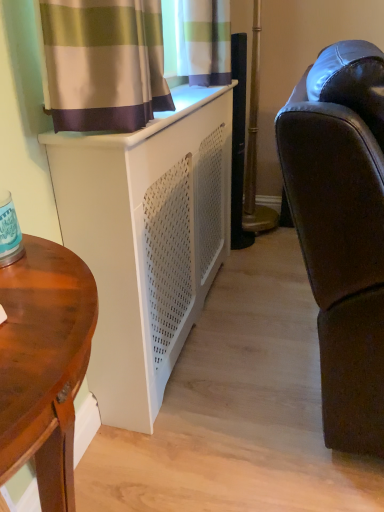
What is the approximate height of white matte cabinet at lower left?

The height of white matte cabinet at lower left is 33.75 inches.

At what (x,y) coordinates should I click in order to perform the action: click on white matte cabinet at lower left. Please return your answer as a coordinate pair (x, y). The image size is (384, 512). Looking at the image, I should click on (146, 240).

From a real-world perspective, is matte black leather couch at right physically below white matte cabinet at lower left?

No, from a real-world perspective, matte black leather couch at right is not beneath white matte cabinet at lower left.

Between matte black leather couch at right and white matte cabinet at lower left, which one has more height?

Standing taller between the two is matte black leather couch at right.

Does matte black leather couch at right lie behind white matte cabinet at lower left?

No, matte black leather couch at right is closer to the camera.

How many degrees apart are the facing directions of matte black leather couch at right and white matte cabinet at lower left?

There is a 0.248-degree angle between the facing directions of matte black leather couch at right and white matte cabinet at lower left.

Can you confirm if white matte cabinet at lower left is thinner than matte black leather couch at right?

Correct, the width of white matte cabinet at lower left is less than that of matte black leather couch at right.

Where is `studio couch on the right of white matte cabinet at lower left`? Image resolution: width=384 pixels, height=512 pixels. studio couch on the right of white matte cabinet at lower left is located at coordinates (342, 230).

Considering the sizes of white matte cabinet at lower left and matte black leather couch at right in the image, is white matte cabinet at lower left taller or shorter than matte black leather couch at right?

In the image, white matte cabinet at lower left appears to be shorter than matte black leather couch at right.

Is wooden desk at left wider than white matte cabinet at lower left?

Indeed, wooden desk at left has a greater width compared to white matte cabinet at lower left.

From the image's perspective, between wooden desk at left and white matte cabinet at lower left, which one is located above?

white matte cabinet at lower left.

Consider the image. Which object is closer to the camera, wooden desk at left or white matte cabinet at lower left?

wooden desk at left is closer to the camera.

Would you say wooden desk at left is outside white matte cabinet at lower left?

wooden desk at left lies outside white matte cabinet at lower left's area.

How much distance is there between matte black leather couch at right and wooden desk at left?

matte black leather couch at right and wooden desk at left are 21.88 inches apart from each other.

Considering the relative sizes of matte black leather couch at right and wooden desk at left in the image provided, is matte black leather couch at right wider than wooden desk at left?

Yes.

Which is nearer, (x=313, y=71) or (x=81, y=274)?

Clearly, point (x=313, y=71) is more distant from the camera than point (x=81, y=274).

Are matte black leather couch at right and wooden desk at left making contact?

No, matte black leather couch at right is not next to wooden desk at left.

From the picture: How far apart are wooden desk at left and matte black leather couch at right?

wooden desk at left is 55.57 centimeters from matte black leather couch at right.

Is wooden desk at left thinner than matte black leather couch at right?

Correct, the width of wooden desk at left is less than that of matte black leather couch at right.

Is wooden desk at left oriented away from matte black leather couch at right?

No, matte black leather couch at right is not at the back of wooden desk at left.

Between wooden desk at left and matte black leather couch at right, which one has more height?

With more height is matte black leather couch at right.

Who is smaller, white matte cabinet at lower left or wooden desk at left?

With smaller size is wooden desk at left.

Is white matte cabinet at lower left thinner than wooden desk at left?

Yes.

Does white matte cabinet at lower left contain wooden desk at left?

No, wooden desk at left is not a part of white matte cabinet at lower left.

Where is `studio couch located above the white matte cabinet at lower left (from the image's perspective)`? This screenshot has width=384, height=512. studio couch located above the white matte cabinet at lower left (from the image's perspective) is located at coordinates (342, 230).

Where is `cabinetry on the left of the matte black leather couch at right`? The height and width of the screenshot is (512, 384). cabinetry on the left of the matte black leather couch at right is located at coordinates (146, 240).

Considering their positions, is matte black leather couch at right positioned closer to white matte cabinet at lower left than wooden desk at left?

matte black leather couch at right.

Based on their spatial positions, is matte black leather couch at right or white matte cabinet at lower left further from wooden desk at left?

Based on the image, matte black leather couch at right appears to be further to wooden desk at left.

Based on their spatial positions, is white matte cabinet at lower left or wooden desk at left closer to matte black leather couch at right?

Among the two, white matte cabinet at lower left is located nearer to matte black leather couch at right.

Based on their spatial positions, is white matte cabinet at lower left or matte black leather couch at right further from wooden desk at left?

matte black leather couch at right is positioned further to the anchor wooden desk at left.

Which object lies nearer to the anchor point white matte cabinet at lower left, wooden desk at left or matte black leather couch at right?

matte black leather couch at right is closer to white matte cabinet at lower left.

Estimate the real-world distances between objects in this image. Which object is further from matte black leather couch at right, wooden desk at left or white matte cabinet at lower left?

Based on the image, wooden desk at left appears to be further to matte black leather couch at right.

I want to click on cabinetry situated between wooden desk at left and matte black leather couch at right from left to right, so click(x=146, y=240).